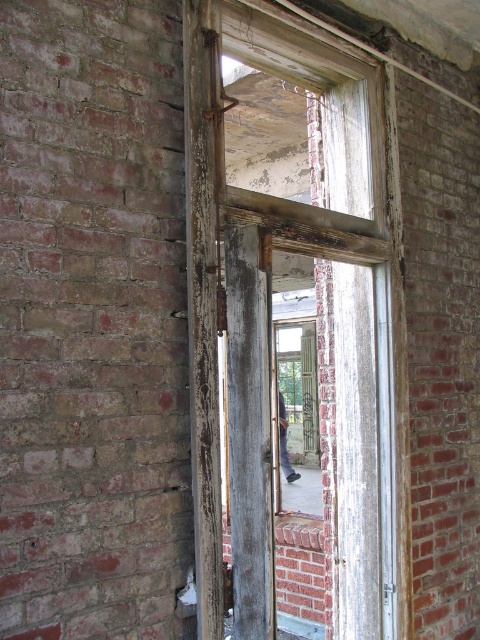
You are trying to fit the dark gray fabric pants at center into a storage container that can only accommodate items as wide as the weathered wood window frame at center. Based on the scene, will the pants fit?

The weathered wood window frame at center is wider than the dark gray fabric pants at center, so the pants will fit into the container since their width is smaller.

You are a painter who needs to paint the weathered wood window frame at center and the dark gray fabric pants at center. Which object should you paint first if you want to start with the taller one?

The weathered wood window frame at center is taller than the dark gray fabric pants at center, so you should paint the weathered wood window frame at center first.